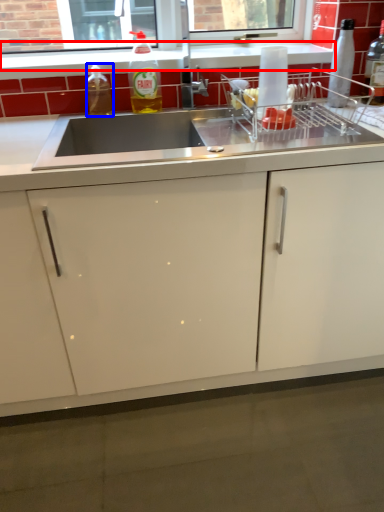
Question: Which object is further to the camera taking this photo, window sill (highlighted by a red box) or bottle (highlighted by a blue box)?

Choices:
 (A) window sill
 (B) bottle

Answer: (A)